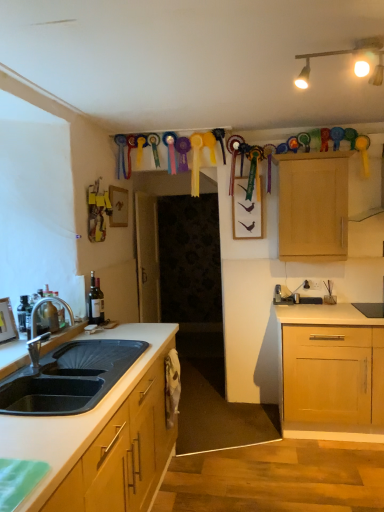
Question: Can you confirm if brushed metal faucet at sink left is smaller than light wood cabinet at upper right?

Choices:
 (A) yes
 (B) no

Answer: (A)

Question: From a real-world perspective, is brushed metal faucet at sink left located beneath light wood cabinet at upper right?

Choices:
 (A) no
 (B) yes

Answer: (B)

Question: Can we say brushed metal faucet at sink left lies outside light wood cabinet at upper right?

Choices:
 (A) yes
 (B) no

Answer: (A)

Question: Are brushed metal faucet at sink left and light wood cabinet at upper right located far from each other?

Choices:
 (A) no
 (B) yes

Answer: (B)

Question: From the image's perspective, is brushed metal faucet at sink left above light wood cabinet at upper right?

Choices:
 (A) no
 (B) yes

Answer: (A)

Question: Does brushed metal faucet at sink left contain light wood cabinet at upper right?

Choices:
 (A) yes
 (B) no

Answer: (B)

Question: From a real-world perspective, is wooden picture frame at left located higher than light wood cabinet at upper right?

Choices:
 (A) no
 (B) yes

Answer: (A)

Question: Is wooden picture frame at left shorter than light wood cabinet at upper right?

Choices:
 (A) no
 (B) yes

Answer: (B)

Question: Is wooden picture frame at left to the right of light wood cabinet at upper right from the viewer's perspective?

Choices:
 (A) yes
 (B) no

Answer: (B)

Question: Is wooden picture frame at left wider than light wood cabinet at upper right?

Choices:
 (A) no
 (B) yes

Answer: (A)

Question: Does wooden picture frame at left lie in front of light wood cabinet at upper right?

Choices:
 (A) no
 (B) yes

Answer: (B)

Question: From a real-world perspective, is wooden picture frame at left positioned under light wood cabinet at upper right based on gravity?

Choices:
 (A) yes
 (B) no

Answer: (A)

Question: From the image's perspective, is matte gold track lights at upper center on top of brushed metal faucet at sink left?

Choices:
 (A) yes
 (B) no

Answer: (A)